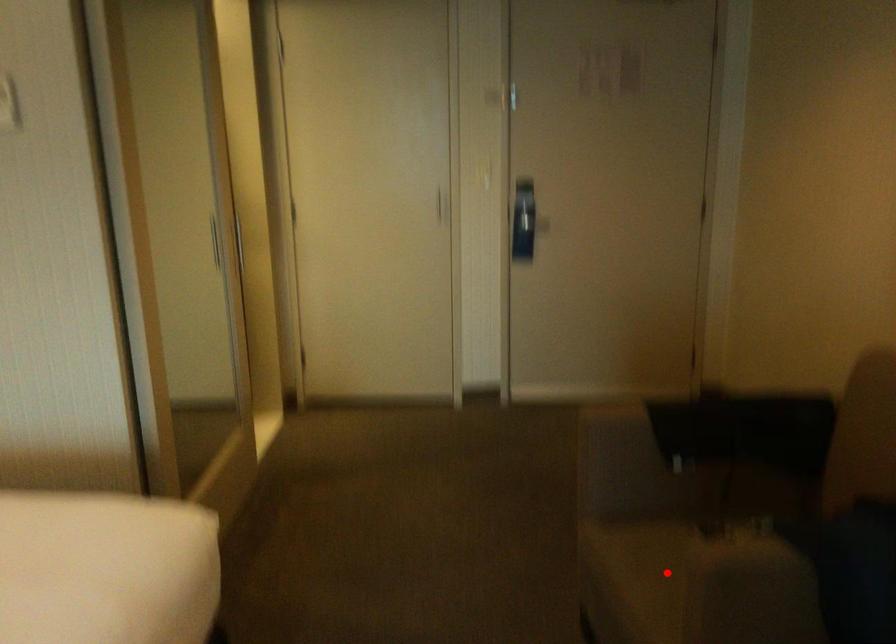
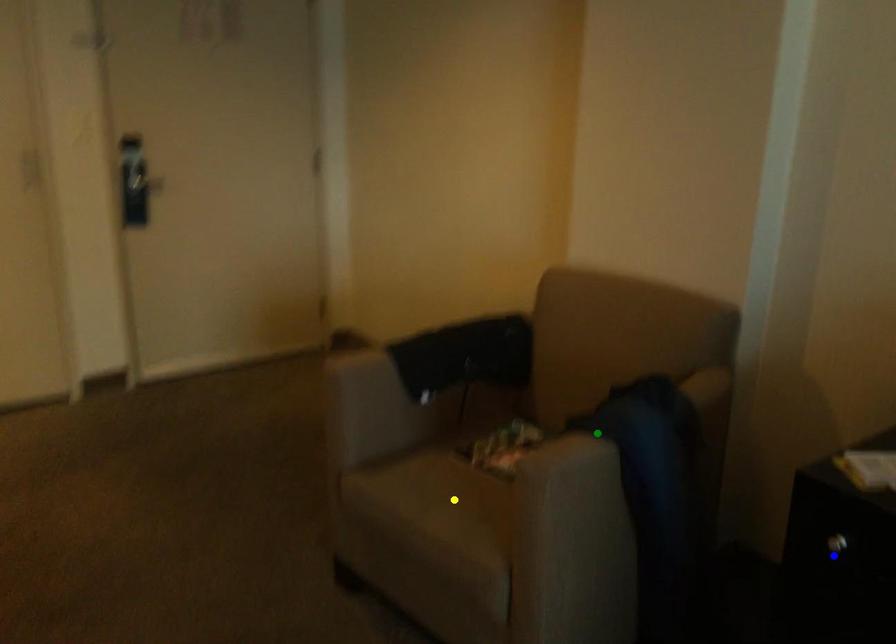
Question: I am providing you with two images of the same scene from different viewpoints. A red point is marked on the first image. You are given multiple points on the second image. Which mark in image 2 goes with the point in image 1?

Choices:
 (A) yellow point
 (B) blue point
 (C) green point

Answer: (A)